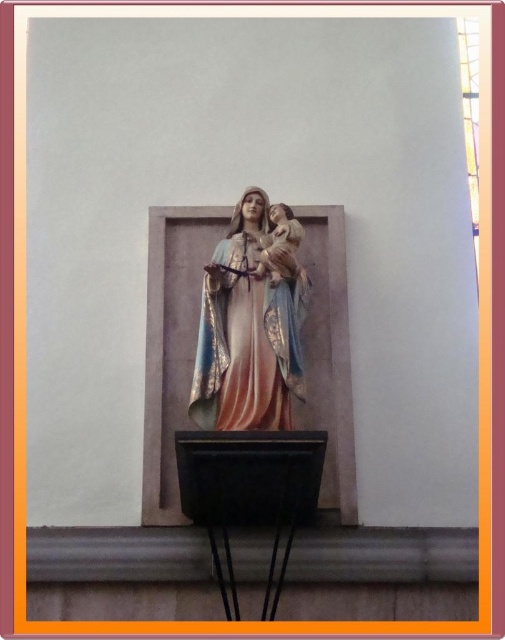
You are an art conservator assessing the placement of the matte painted statue at center within its niche. Based on the coordinates provided, is the statue positioned exactly at the center of the niche?

The coordinates of the matte painted statue at center are given as point (248, 326). Since the coordinates are nearly 0.5 in both x and y axes, the statue is positioned very close to the center of the niche.

You are an art conservator assessing the space in front of the matte painted statue at center and the transparent glass window at upper right. Which object occupies a larger horizontal space?

The matte painted statue at center is wider than the transparent glass window at upper right, so it occupies a larger horizontal space.

You are an art conservator assessing the placement of objects in the image. The matte painted statue at center and the transparent glass window at upper right are both present. Based on their positions, which object is located higher up?

The transparent glass window at upper right is located higher up than the matte painted statue at center.